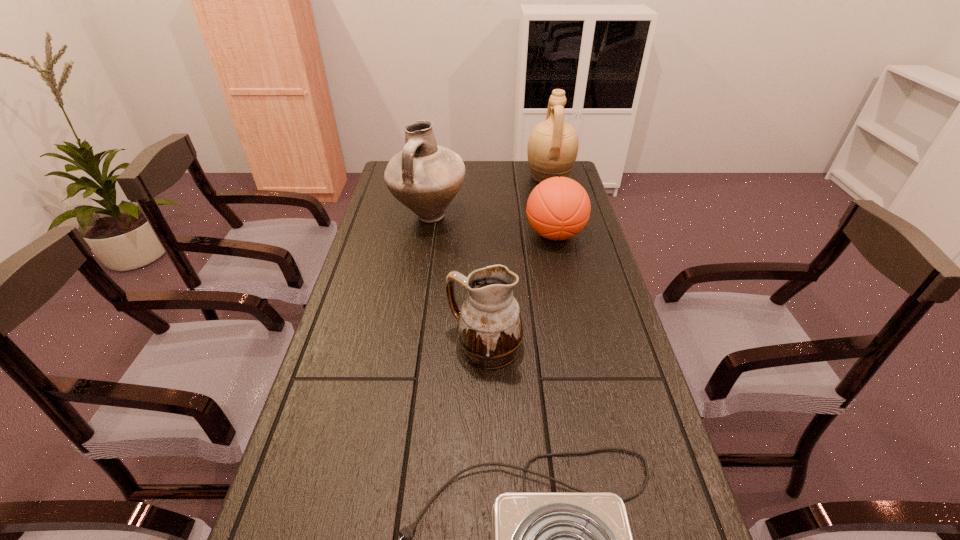
This screenshot has width=960, height=540. In order to click on free point located from the spout of the third tallest object in this screenshot , I will do `click(427, 347)`.

The width and height of the screenshot is (960, 540). I want to click on vacant space situated 0.280m on the front of the basketball, so click(x=573, y=316).

I want to click on object positioned at the far edge, so click(x=552, y=149).

The width and height of the screenshot is (960, 540). Identify the location of object that is at the left edge. (425, 177).

Where is `pitcher positioned at the right edge`? pitcher positioned at the right edge is located at coordinates (552, 149).

Locate an element on the screen. The image size is (960, 540). basketball that is positioned at the right edge is located at coordinates (558, 208).

Where is `object at the far right corner`? Image resolution: width=960 pixels, height=540 pixels. object at the far right corner is located at coordinates pyautogui.click(x=552, y=149).

Locate an element on the screen. free space at the far edge is located at coordinates (508, 170).

Where is `vacant area at the left edge of the desktop`? The image size is (960, 540). vacant area at the left edge of the desktop is located at coordinates tap(323, 427).

You are a GUI agent. You are given a task and a screenshot of the screen. Output one action in this format:
    pyautogui.click(x=<x>, y=<y>)
    Task: Click on the vacant region at the right edge of the desktop
    This screenshot has height=540, width=960.
    Given the screenshot: What is the action you would take?
    pyautogui.click(x=607, y=351)